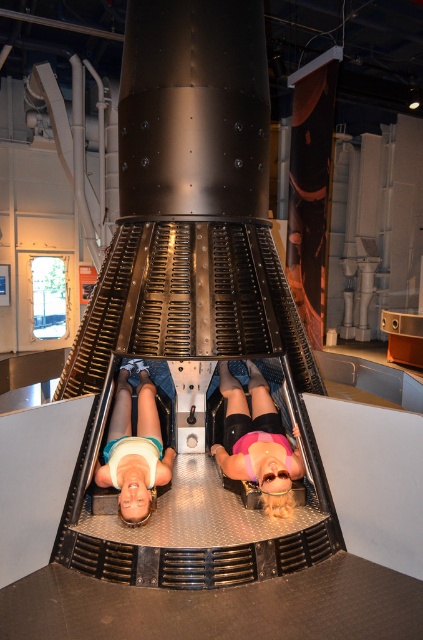
Can you confirm if pink matte shorts at center is positioned to the right of matte white shirt at center?

Correct, you'll find pink matte shorts at center to the right of matte white shirt at center.

Can you confirm if pink matte shorts at center is positioned to the left of matte white shirt at center?

No, pink matte shorts at center is not to the left of matte white shirt at center.

Between point (233, 384) and point (104, 465), which one is positioned behind?

The point (233, 384) is behind.

I want to click on pink matte shorts at center, so click(x=257, y=442).